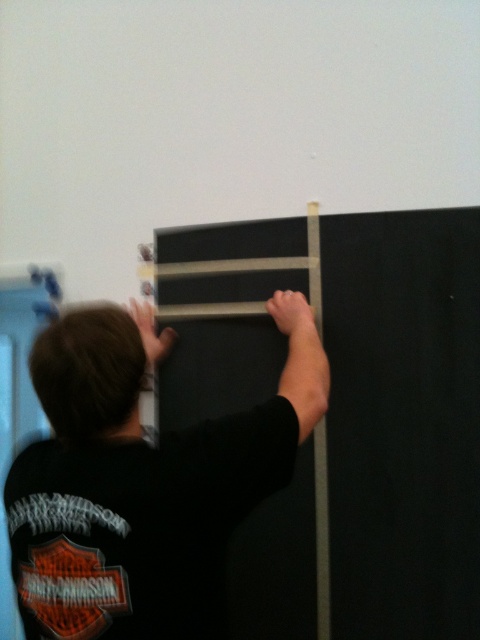
You are a painter who needs to reach the top of the ladder. You see the black matte shirt at center and the black matte ladder at center. Which object should you avoid stepping on to reach the ladder safely?

You should avoid stepping on the black matte shirt at center because it is positioned over the black matte ladder at center, so the shirt is blocking access to the ladder.

You are a contractor working on a renovation project. You notice two points marked on a blueprint at coordinates point (220, 444) and point (244, 342). Based on the scene provided, which point is closer to the person applying the tape?

Point (220, 444) is closer to the person applying the tape because it is in front of point (244, 342).